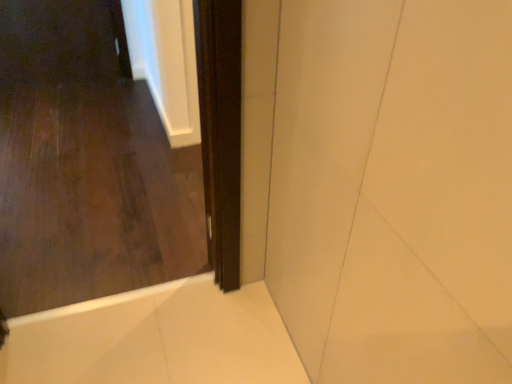
Locate an element on the screen. This screenshot has width=512, height=384. vacant point above white glossy bath at lower right (from a real-world perspective) is located at coordinates [x=154, y=338].